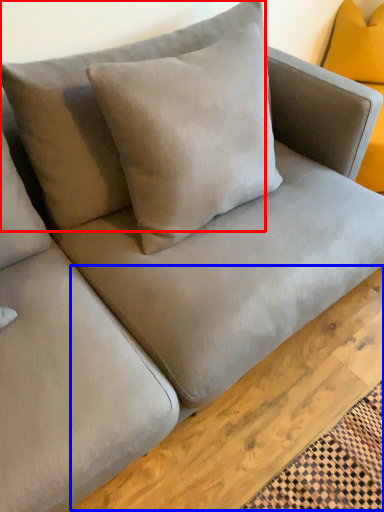
Question: Which object appears farthest to the camera in this image, pillow (highlighted by a red box) or plank (highlighted by a blue box)?

Choices:
 (A) pillow
 (B) plank

Answer: (B)